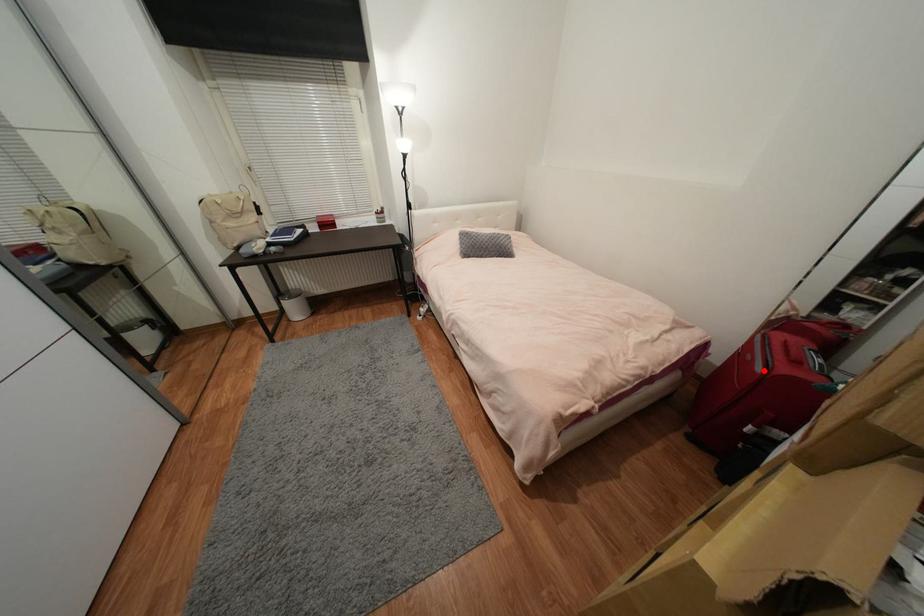
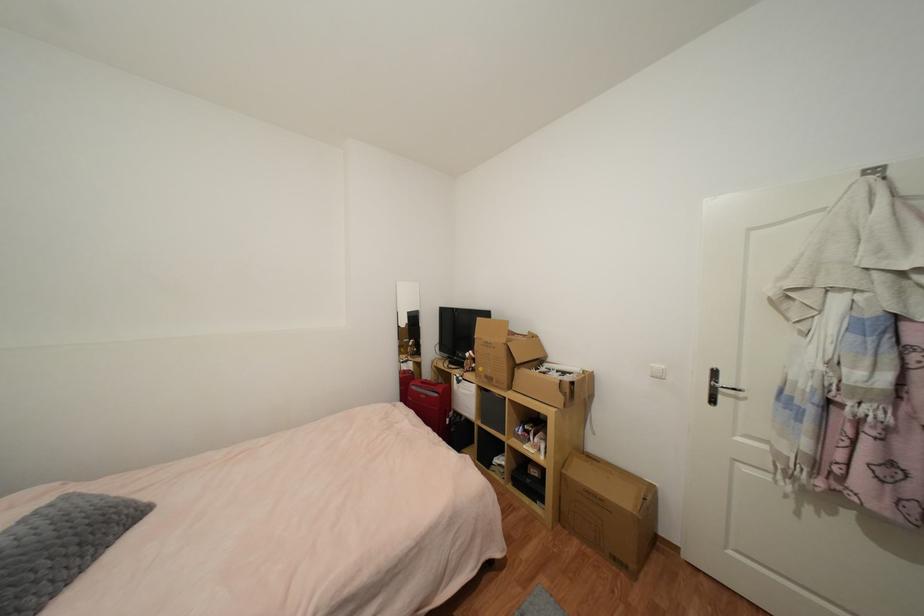
Question: I am providing you with two images of the same scene from different viewpoints. Given a red point in image1, look at the same physical point in image2. Is it:

Choices:
 (A) Closer to the viewpoint
 (B) Farther from the viewpoint

Answer: (B)